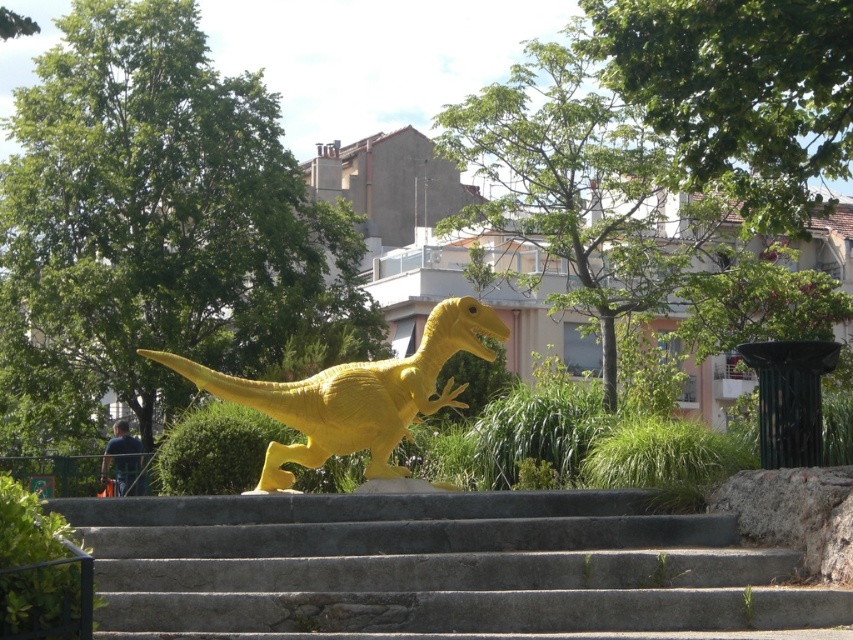
Question: Is gray concrete stairs at center above matte yellow dinosaur at center?

Choices:
 (A) no
 (B) yes

Answer: (A)

Question: Can you confirm if gray concrete stairs at center is positioned above matte yellow dinosaur at center?

Choices:
 (A) yes
 (B) no

Answer: (B)

Question: Which of the following is the closest to the observer?

Choices:
 (A) gray concrete stairs at center
 (B) matte yellow dinosaur at center

Answer: (A)

Question: Which point is farther from the camera taking this photo?

Choices:
 (A) click(433, 346)
 (B) click(547, 513)

Answer: (A)

Question: Does gray concrete stairs at center have a smaller size compared to matte yellow dinosaur at center?

Choices:
 (A) no
 (B) yes

Answer: (B)